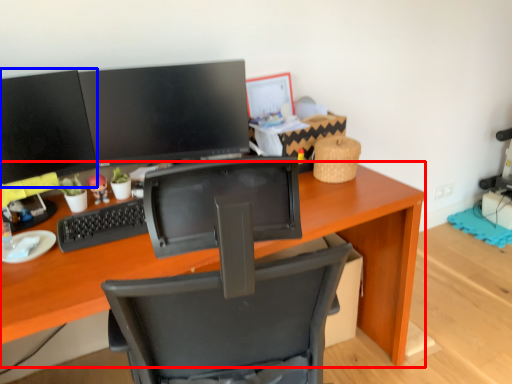
Question: Which of the following is the closest to the observer, desk (highlighted by a red box) or computer monitor (highlighted by a blue box)?

Choices:
 (A) desk
 (B) computer monitor

Answer: (A)